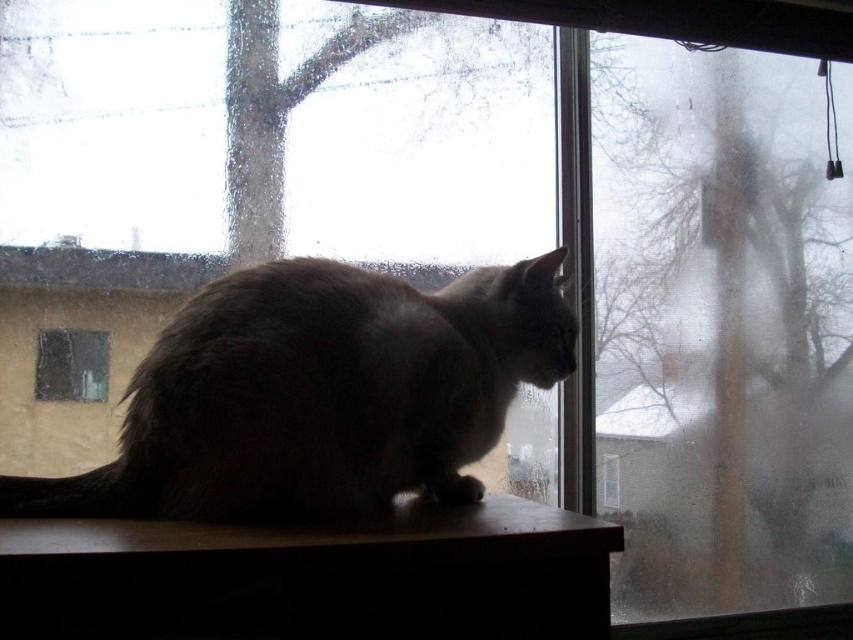
You are standing in the room where the cat is sitting. You want to look through the clear glass window at center to see outside. Where should you go to get the best view? The coordinates given are point (71, 365). Please provide your answer in the format of coordinates.

The best view is at point (71, 365), which corresponds to the clear glass window at center.

You are trying to determine which window is better for observing the outside world. Based on the description, which window between the clear glass window at center and the transparent glass window at center allows for a clearer view?

The clear glass window at center is much taller than transparent glass window at center, but the description does not provide information about clarity or transparency differences between the two windows. Therefore, it is impossible to determine which window allows for a clearer view based solely on the provided details.

You are taking a photo of the cat and want to focus on the point at point [457,390] and point [608,493]. Which point is closer to the camera?

Point [457,390] is closer to the camera than point [608,493].